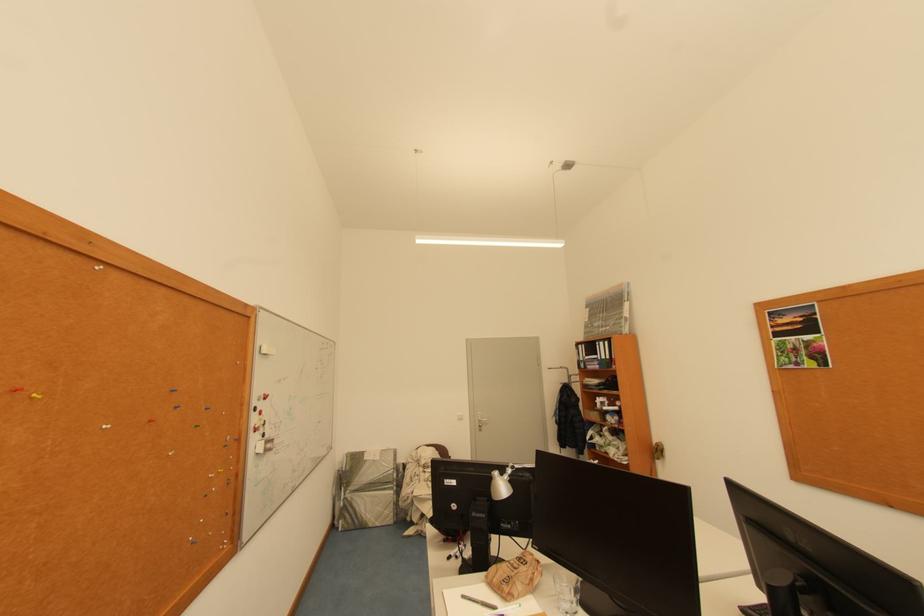
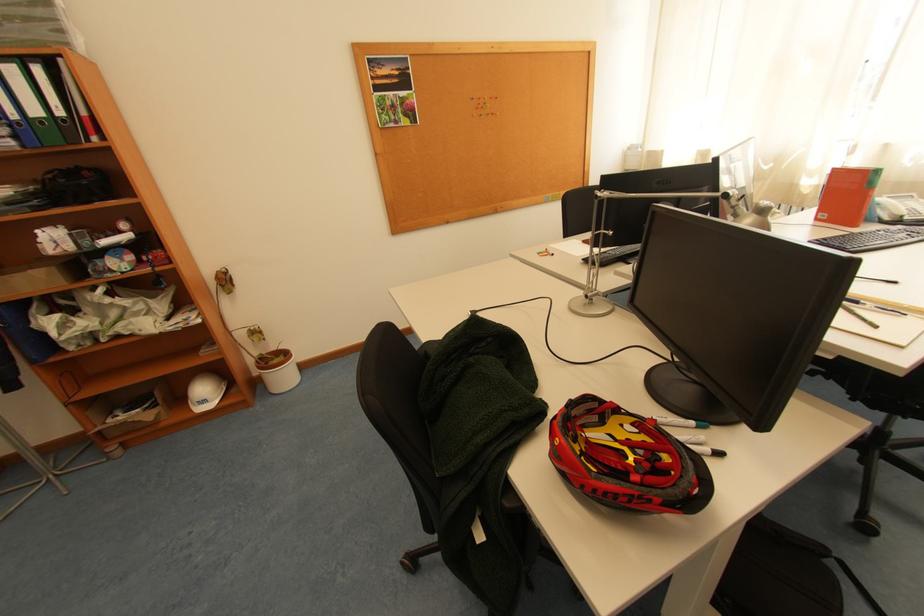
The point at (612, 358) is marked in the first image. Where is the corresponding point in the second image?

(44, 113)